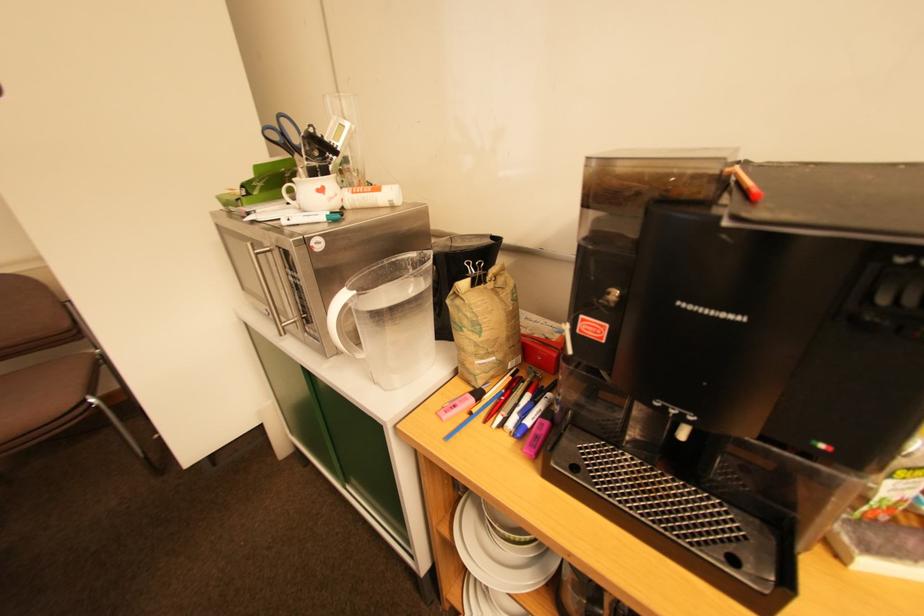
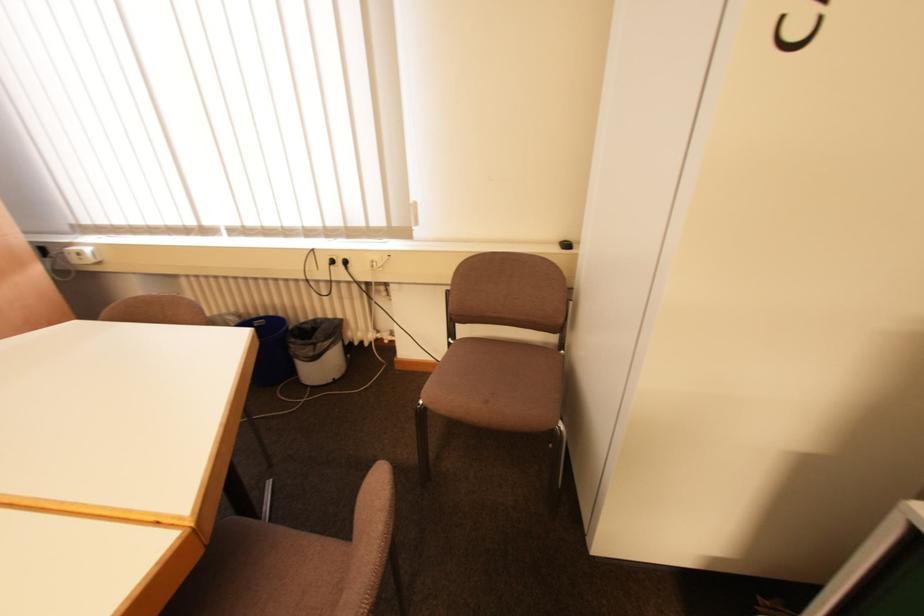
Question: How did the camera likely rotate?

Choices:
 (A) Left
 (B) Right
 (C) Up
 (D) Down

Answer: (A)